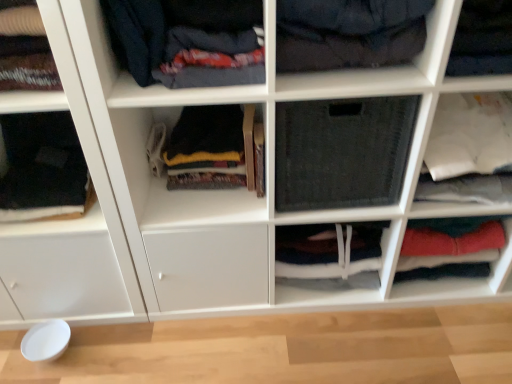
Question: Which is correct: dark gray fabric at center, the second cabinet viewed from the right, is inside dark blue fabric at upper left, arranged as the second clothing when viewed from the right, or outside of it?

Choices:
 (A) outside
 (B) inside

Answer: (A)

Question: In the image, is dark gray fabric at center, which ranks as the first cabinet in left-to-right order, positioned in front of or behind dark blue fabric at upper left, acting as the 3th clothing starting from the left?

Choices:
 (A) behind
 (B) front

Answer: (A)

Question: Which of these objects is positioned closest to the black fabric at left, marked as the first clothing in a left-to-right arrangement?

Choices:
 (A) white glossy cabinet at left, the fifth shelf viewed from the right
 (B) dark gray fabric at center, the second cabinet viewed from the right
 (C) white matte fabric at upper left, the 2th shelf from the left
 (D) dark blue fabric at upper center, placed as the third shelf when sorted from right to left
 (E) black fabric at center, placed as the 4th clothing when sorted from left to right

Answer: (A)

Question: Based on their relative distances, which object is farther from the black fabric at center, arranged as the first shelf when viewed from the right?

Choices:
 (A) dark gray fabric at center, the second cabinet viewed from the right
 (B) dark gray fleece sweater at center, the second clothing when ordered from left to right
 (C) white glossy cabinet at left, which is counted as the 1th shelf, starting from the left
 (D) black fabric at upper right, the 2th shelf viewed from the right
 (E) red fabric pants at lower right, positioned as the second cabinet in left-to-right order

Answer: (C)